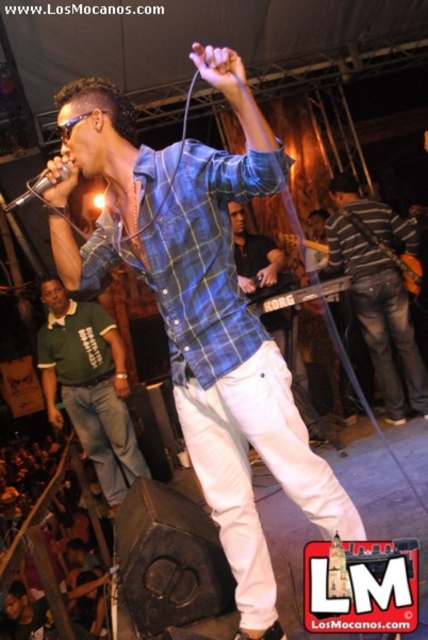
Question: Is green polo shirt at left in front of matte black keyboard at center?

Choices:
 (A) yes
 (B) no

Answer: (B)

Question: Among these objects, which one is farthest from the camera?

Choices:
 (A) green polo shirt at left
 (B) blue plaid shirt at center
 (C) wooden electric guitar at center

Answer: (A)

Question: Can you confirm if matte black keyboard at center is positioned to the left of wooden electric guitar at center?

Choices:
 (A) yes
 (B) no

Answer: (A)

Question: Which point appears closest to the camera in this image?

Choices:
 (A) (294, 380)
 (B) (80, 467)
 (C) (133, 426)

Answer: (A)

Question: Is blue plaid shirt at center to the left of wooden electric guitar at center from the viewer's perspective?

Choices:
 (A) yes
 (B) no

Answer: (A)

Question: Among these points, which one is nearest to the camera?

Choices:
 (A) (269, 275)
 (B) (394, 392)
 (C) (403, 257)
 (D) (42, 573)

Answer: (D)